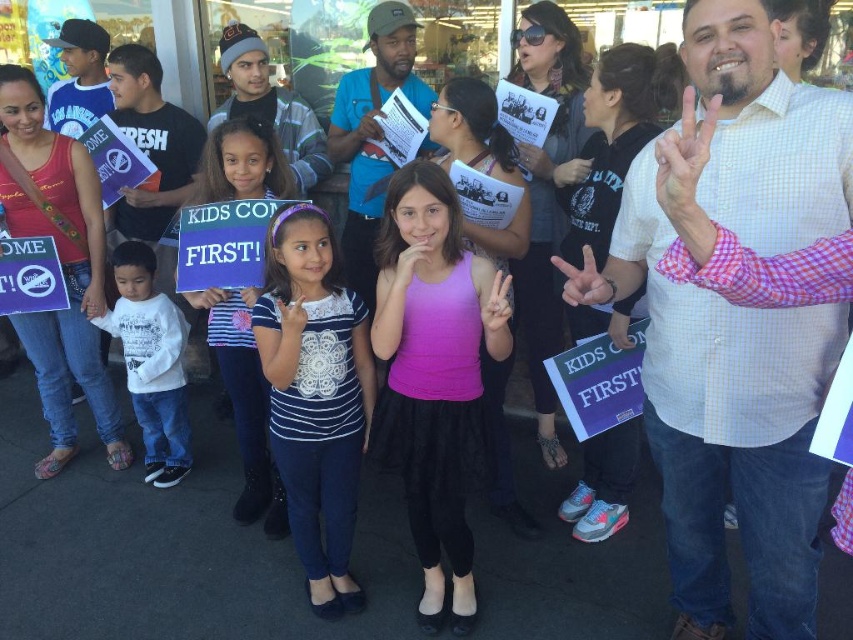
You are a photographer trying to capture a photo of the white lace shirt at center and the striped fabric dress at center. If you want to ensure both are fully visible in the frame, which object should you adjust your camera angle to focus on first?

The white lace shirt at center is wider than the striped fabric dress at center, so you should focus on capturing the white lace shirt at center first to ensure its full width fits in the frame before adjusting for the narrower striped fabric dress at center.

What are the coordinates of the white lace shirt at center?

The white lace shirt at center is located at coordinates point (315, 396).